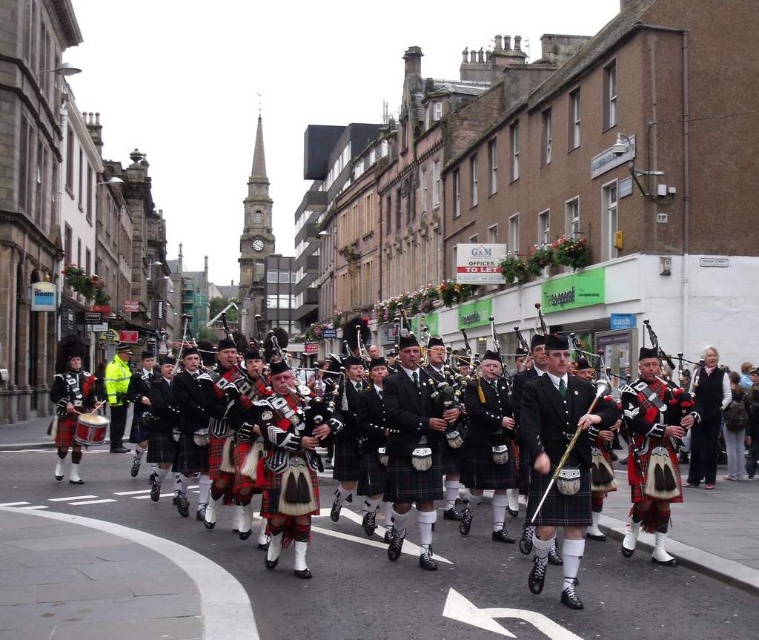
You are a photographer trying to capture the entire marching band in one photo. You notice the polished wood bagpipes at center and the brass drum at center. Which object should you focus on to ensure both are in frame?

The polished wood bagpipes at center are larger in size compared to the brass drum at center. To ensure both are in frame, focus on the polished wood bagpipes at center as it occupies more space, allowing the smaller brass drum at center to fit within the same shot.

You are a photographer trying to capture a closeup of the matte black kilt at center and the polished wood bagpipes at center. If you want to frame both objects in the same shot without moving your camera, which object should you ensure is closer to the camera to avoid cropping?

The matte black kilt at center has a larger width than the polished wood bagpipes at center. To include both in the frame without cropping, the matte black kilt at center should be closer to the camera since its larger size requires more space in the frame.